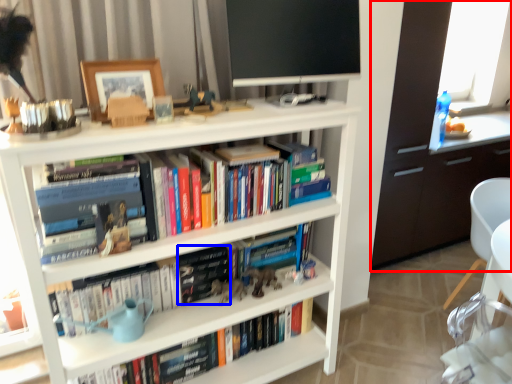
Question: Which point is further to the camera, cabinetry (highlighted by a red box) or paperback book (highlighted by a blue box)?

Choices:
 (A) cabinetry
 (B) paperback book

Answer: (A)